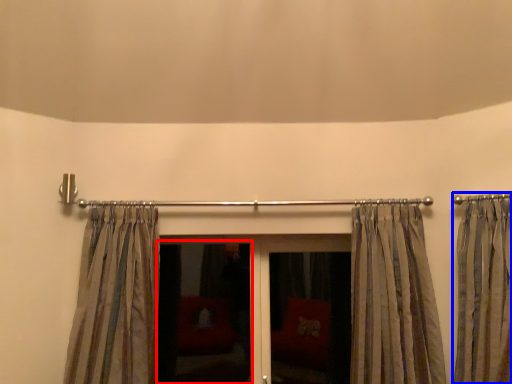
Question: Among these objects, which one is nearest to the camera, screen door (highlighted by a red box) or curtain (highlighted by a blue box)?

Choices:
 (A) screen door
 (B) curtain

Answer: (B)